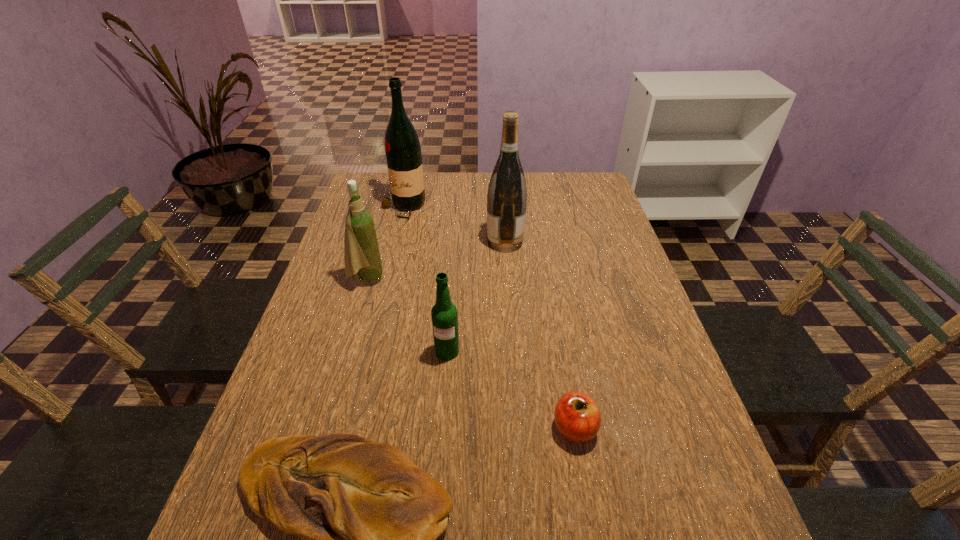
Identify the location of the farthest object. The width and height of the screenshot is (960, 540). (402, 146).

Where is `the second farthest wine bottle`? The image size is (960, 540). the second farthest wine bottle is located at coordinates (507, 193).

Find the location of a particular element. the second farthest object is located at coordinates pos(507,193).

You are a GUI agent. You are given a task and a screenshot of the screen. Output one action in this format:
    pyautogui.click(x=<x>, y=<y>)
    Task: Click on the fourth nearest object
    This screenshot has height=540, width=960.
    Given the screenshot: What is the action you would take?
    pyautogui.click(x=362, y=256)

Locate an element on the screen. The image size is (960, 540). the shortest wine bottle is located at coordinates (362, 256).

In order to click on the fourth farthest object in this screenshot , I will do `click(444, 315)`.

Locate an element on the screen. The width and height of the screenshot is (960, 540). beer bottle is located at coordinates tap(444, 315).

At what (x,y) coordinates should I click in order to perform the action: click on the rightmost object. Please return your answer as a coordinate pair (x, y). Looking at the image, I should click on (577, 418).

Locate an element on the screen. This screenshot has width=960, height=540. free space located 0.360m on the right of the farthest object is located at coordinates (531, 208).

At what (x,y) coordinates should I click in order to perform the action: click on free point located 0.250m on the label of the second nearest wine bottle. Please return your answer as a coordinate pair (x, y). Image resolution: width=960 pixels, height=540 pixels. Looking at the image, I should click on (405, 242).